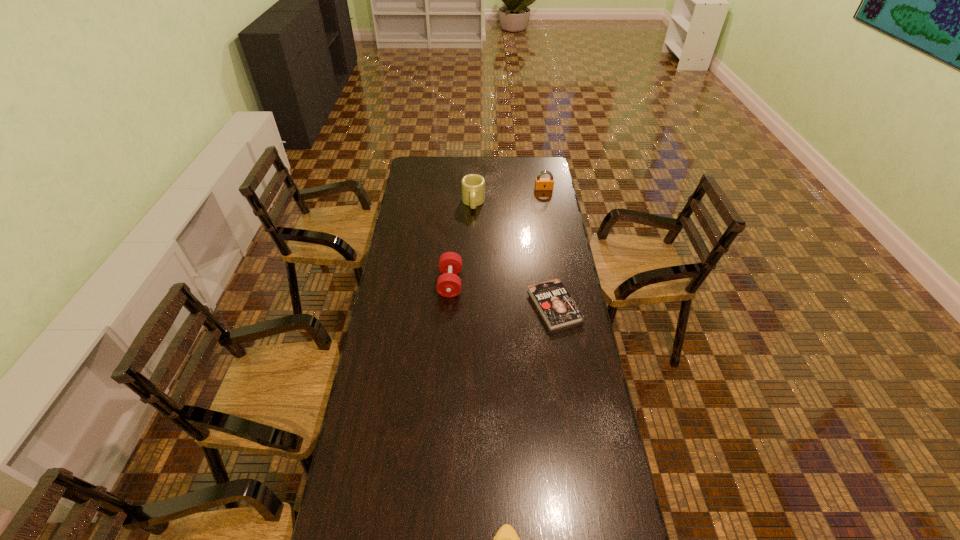
You are a GUI agent. You are given a task and a screenshot of the screen. Output one action in this format:
    pyautogui.click(x=<x>, y=<y>)
    Task: Click on the mug
    Image resolution: width=960 pixels, height=540 pixels.
    Given the screenshot: What is the action you would take?
    pyautogui.click(x=473, y=185)

I want to click on padlock, so click(x=540, y=183).

What are the coordinates of `dumbbell` in the screenshot? It's located at (450, 263).

This screenshot has width=960, height=540. Identify the location of the shortest object. pyautogui.click(x=558, y=309).

Where is `vacant point located 0.120m with the handle on the side of the mug`? The height and width of the screenshot is (540, 960). vacant point located 0.120m with the handle on the side of the mug is located at coordinates (473, 228).

This screenshot has height=540, width=960. What are the coordinates of `vacant space located 0.290m to unlock the padlock from the front` in the screenshot? It's located at (550, 224).

At what (x,y) coordinates should I click in order to perform the action: click on vacant space located 0.250m on the back of the dumbbell. Please return your answer as a coordinate pair (x, y). Image resolution: width=960 pixels, height=540 pixels. Looking at the image, I should click on (454, 232).

Where is `vacant space located on the back of the shortest object`? vacant space located on the back of the shortest object is located at coordinates (545, 251).

Identify the location of padlock located at the right edge. (540, 183).

I want to click on book present at the right edge, so click(x=558, y=309).